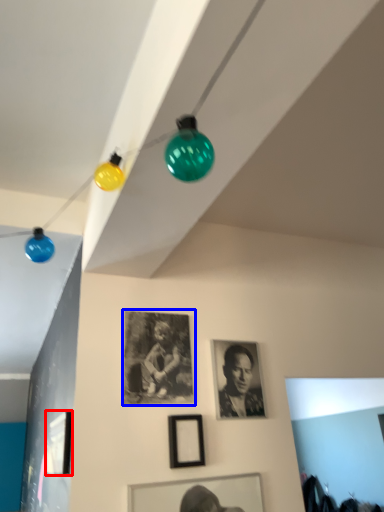
Question: Which of the following is the farthest to the observer, picture frame (highlighted by a red box) or picture frame (highlighted by a blue box)?

Choices:
 (A) picture frame
 (B) picture frame

Answer: (B)